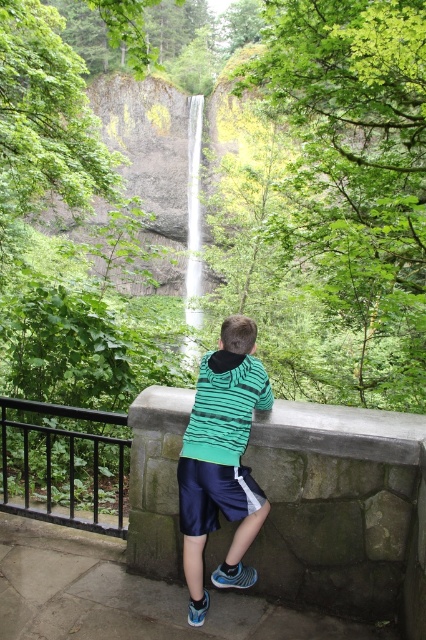
You are standing at the point labeled point (201,442) and want to walk to the point labeled point (5,477). Based on the scene description, will you be moving towards the camera or away from it?

Since point (201,442) is closer to the camera than point (5,477), moving from point (201,442) to point (5,477) means you are moving away from the camera.

In the scene shown: You are a photographer trying to capture the boy in the scene. Since the green striped hoodie at center and the black metal railing at left are both in view, which object is taller and would require adjusting the camera angle to ensure the entire subject is in frame?

The green striped hoodie at center is taller than the black metal railing at left, so you should adjust the camera angle to account for its height to ensure the entire subject is captured in the frame.

You are standing at the scene and want to lean on the black metal railing at left. Based on the coordinates provided, where exactly should you position yourself to reach it?

The black metal railing at left is located at coordinates point (63, 465), so you should position yourself there to reach it.